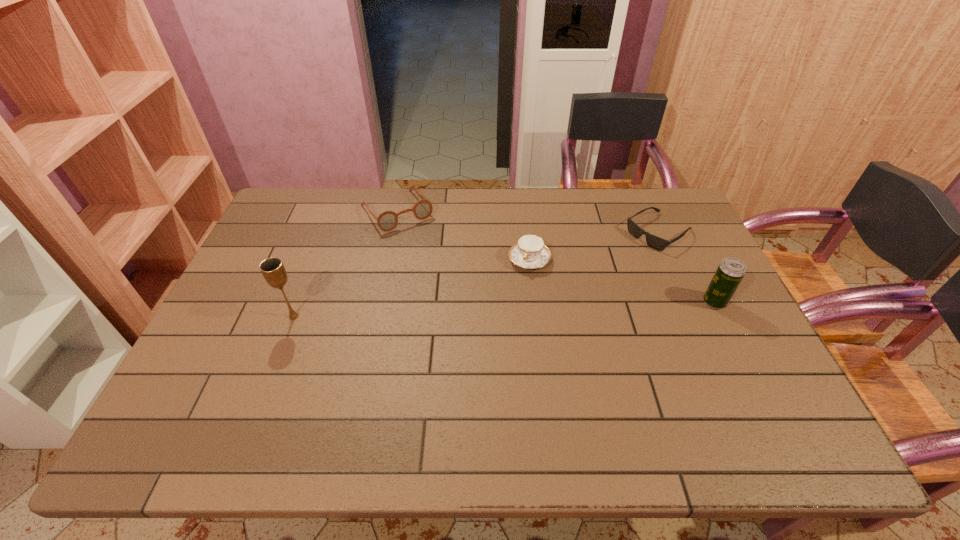
Identify the location of sunglasses that is at the right edge. This screenshot has height=540, width=960. (652, 241).

In order to click on object situated at the far right corner in this screenshot , I will do `click(652, 241)`.

Find the location of a particular element. Image resolution: width=960 pixels, height=540 pixels. vacant position at the far edge of the desktop is located at coordinates (455, 215).

I want to click on vacant region at the near edge, so click(361, 395).

Locate an element on the screen. Image resolution: width=960 pixels, height=540 pixels. vacant space at the left edge of the desktop is located at coordinates (263, 242).

Where is `vacant area at the right edge`? This screenshot has height=540, width=960. vacant area at the right edge is located at coordinates (701, 270).

Identify the location of free space at the far left corner. (281, 214).

Identify the location of free space at the near right corner of the desktop. The height and width of the screenshot is (540, 960). (745, 391).

Locate an element on the screen. This screenshot has width=960, height=540. free spot between the fourth object from right to left and the fourth shortest object is located at coordinates (556, 256).

Where is `vacant area that lies between the beer can and the sunglasses`? The image size is (960, 540). vacant area that lies between the beer can and the sunglasses is located at coordinates point(686,267).